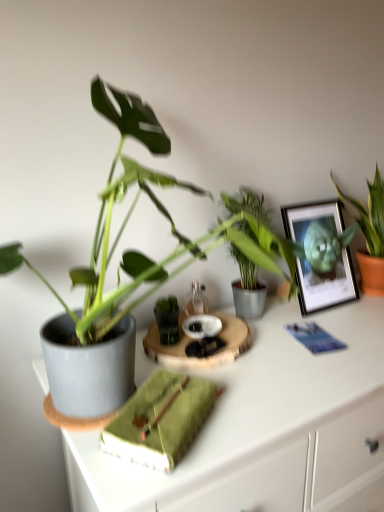
Question: From a real-world perspective, is green leafy plant at upper right, the 2th houseplant in the front-to-back sequence, located higher than matte gray pot at left?

Choices:
 (A) no
 (B) yes

Answer: (B)

Question: From a real-world perspective, is green leafy plant at upper right, acting as the first houseplant starting from the right, physically below matte gray pot at left?

Choices:
 (A) yes
 (B) no

Answer: (B)

Question: From the image's perspective, is green leafy plant at upper right, marked as the second houseplant in a left-to-right arrangement, over matte gray pot at left?

Choices:
 (A) yes
 (B) no

Answer: (A)

Question: From the image's perspective, is green leafy plant at upper right, marked as the second houseplant in a left-to-right arrangement, beneath matte gray pot at left?

Choices:
 (A) yes
 (B) no

Answer: (B)

Question: Considering the relative sizes of green leafy plant at upper right, marked as the second houseplant in a left-to-right arrangement, and matte gray pot at left in the image provided, is green leafy plant at upper right, marked as the second houseplant in a left-to-right arrangement, wider than matte gray pot at left?

Choices:
 (A) yes
 (B) no

Answer: (B)

Question: From the image's perspective, is metallic silver picture frame at upper right above or below matte gray pot at center-left, which appears as the 2th houseplant when viewed from the back?

Choices:
 (A) below
 (B) above

Answer: (B)

Question: Considering the positions of metallic silver picture frame at upper right and matte gray pot at center-left, which appears as the 2th houseplant when viewed from the back, in the image, is metallic silver picture frame at upper right taller or shorter than matte gray pot at center-left, which appears as the 2th houseplant when viewed from the back,?

Choices:
 (A) tall
 (B) short

Answer: (B)

Question: Is metallic silver picture frame at upper right spatially inside matte gray pot at center-left, which appears as the 2th houseplant when viewed from the back, or outside of it?

Choices:
 (A) inside
 (B) outside

Answer: (B)

Question: In terms of size, does metallic silver picture frame at upper right appear bigger or smaller than matte gray pot at center-left, which appears as the 2th houseplant when viewed from the right?

Choices:
 (A) small
 (B) big

Answer: (A)

Question: From the image's perspective, is matte gray pot at left above or below metallic silver picture frame at upper right?

Choices:
 (A) above
 (B) below

Answer: (B)

Question: From a real-world perspective, is matte gray pot at left physically located above or below metallic silver picture frame at upper right?

Choices:
 (A) below
 (B) above

Answer: (A)

Question: Is matte gray pot at left wider or thinner than metallic silver picture frame at upper right?

Choices:
 (A) thin
 (B) wide

Answer: (B)

Question: Based on their positions, is matte gray pot at left located to the left or right of metallic silver picture frame at upper right?

Choices:
 (A) left
 (B) right

Answer: (B)

Question: Based on their positions, is green fabric book at center located to the left or right of metallic silver picture frame at upper right?

Choices:
 (A) right
 (B) left

Answer: (B)

Question: Is green fabric book at center situated inside metallic silver picture frame at upper right or outside?

Choices:
 (A) outside
 (B) inside

Answer: (A)